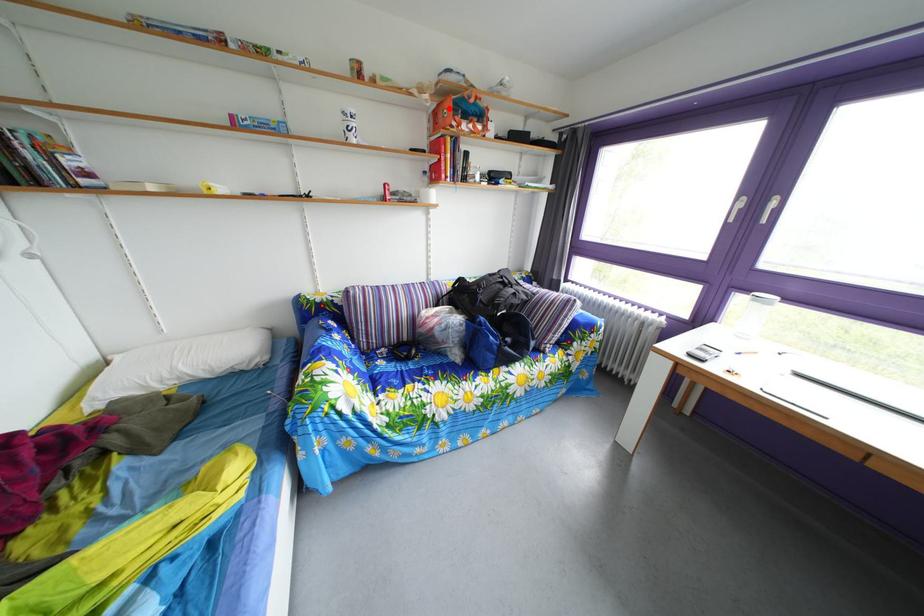
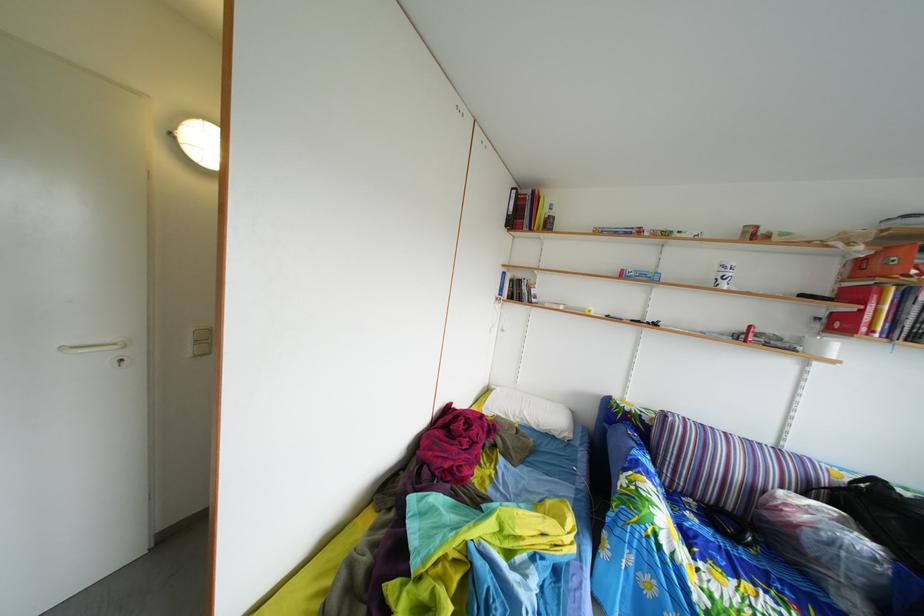
Question: I am providing you with two images of the same scene from different viewpoints. A red point is marked on the first image. Is the red point's position out of view in image 2?

Choices:
 (A) Yes
 (B) No

Answer: (B)